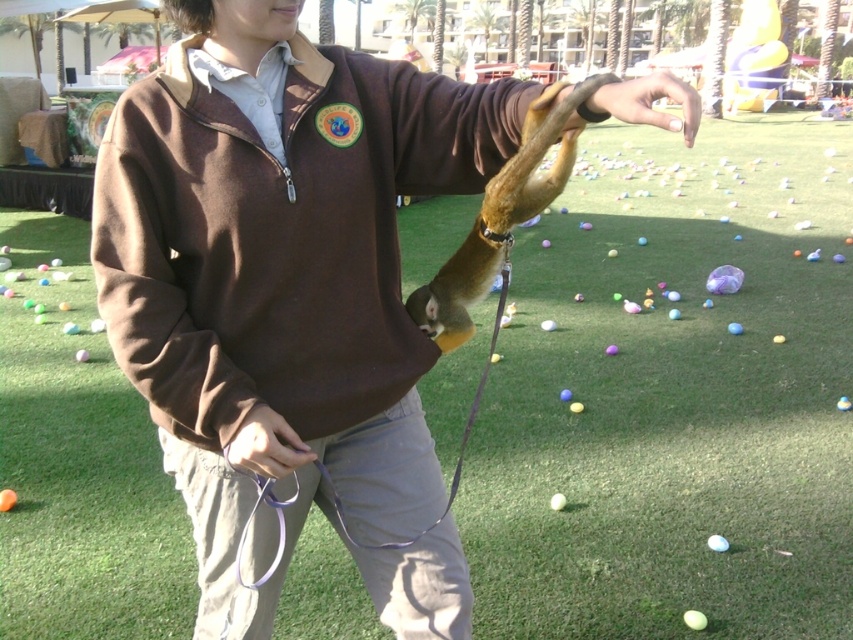
In the scene shown: Is brown fleece sweater at center bigger than nail polish at center?

Correct, brown fleece sweater at center is larger in size than nail polish at center.

Identify the location of brown fleece sweater at center. (281, 273).